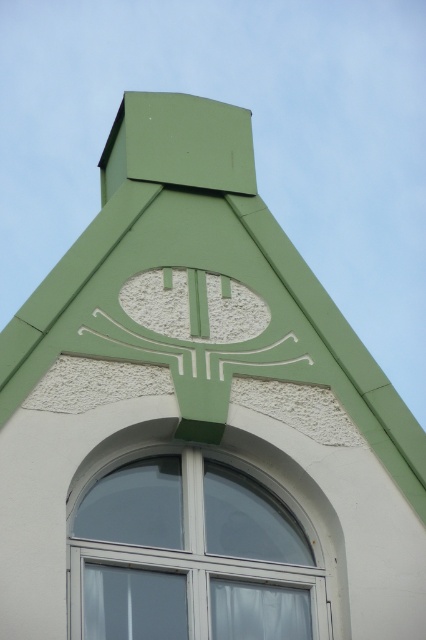
Which is below, green matte roof at center or white plastic window at center?

white plastic window at center is lower down.

Which is above, green matte roof at center or white plastic window at center?

green matte roof at center is higher up.

Locate an element on the screen. green matte roof at center is located at coordinates (201, 284).